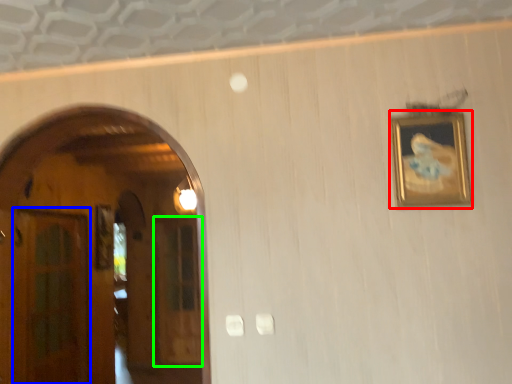
Question: Which is nearer to the picture frame (highlighted by a red box)? glass door (highlighted by a blue box) or glass door (highlighted by a green box).

Choices:
 (A) glass door
 (B) glass door

Answer: (A)